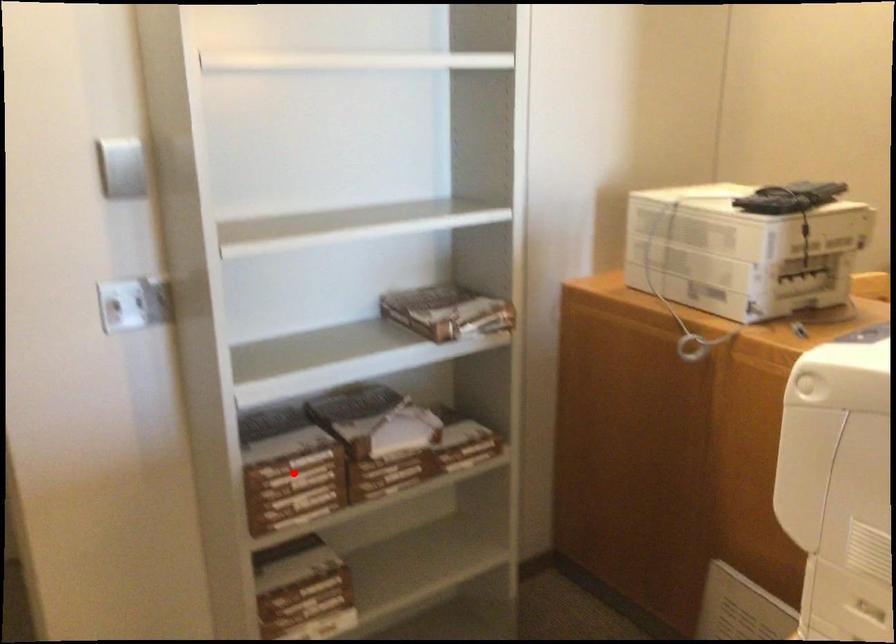
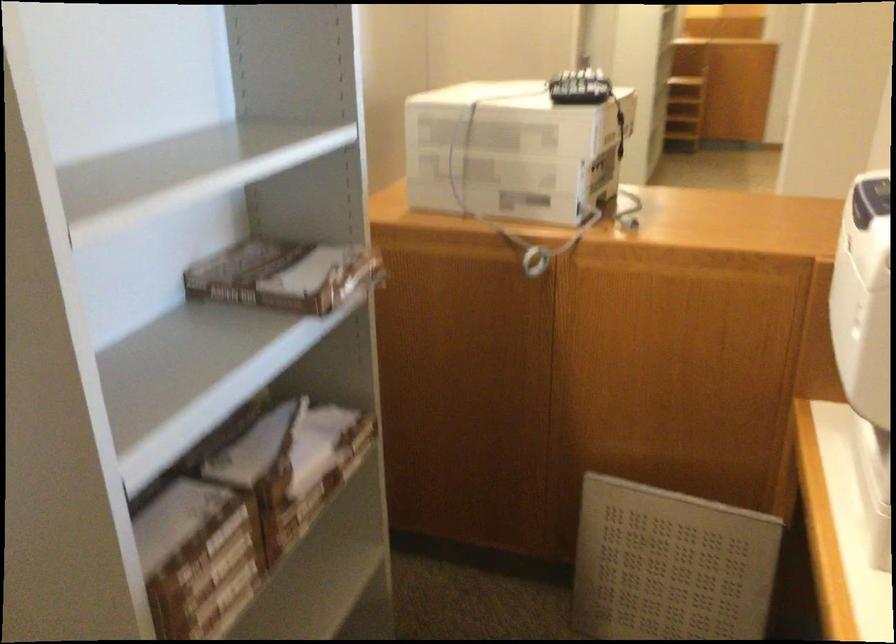
Locate, in the second image, the point that corresponds to the highlighted location in the first image.

(209, 556)